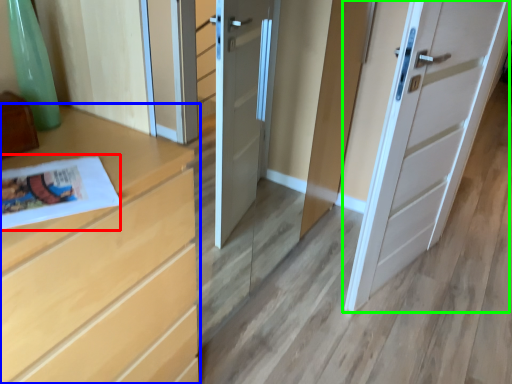
Question: Which object is the farthest from magazine (highlighted by a red box)? Choose among these: chest of drawers (highlighted by a blue box) or door (highlighted by a green box).

Choices:
 (A) chest of drawers
 (B) door

Answer: (B)